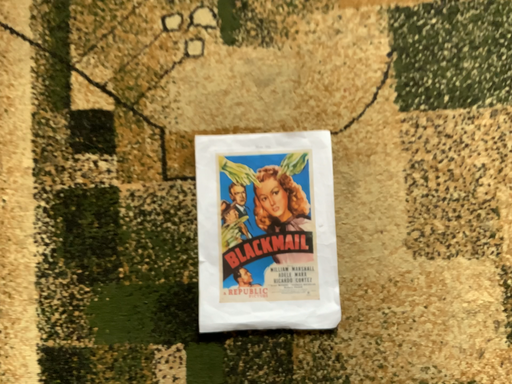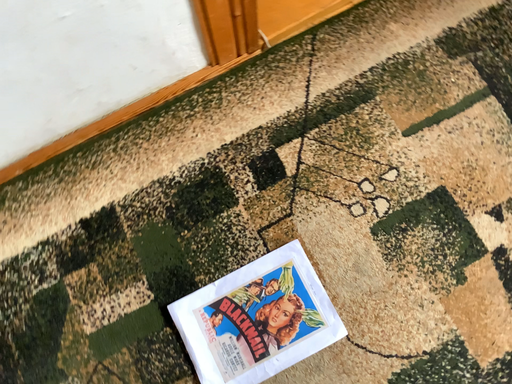
Question: How did the camera likely rotate when shooting the video?

Choices:
 (A) rotated upward
 (B) rotated downward

Answer: (A)